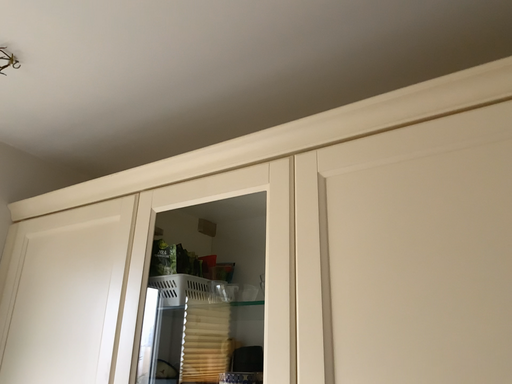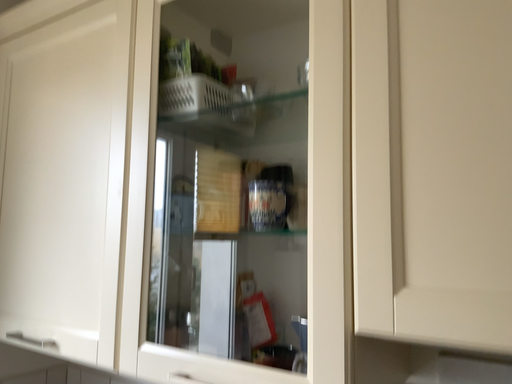
Question: Which way did the camera rotate in the video?

Choices:
 (A) rotated upward
 (B) rotated downward

Answer: (B)